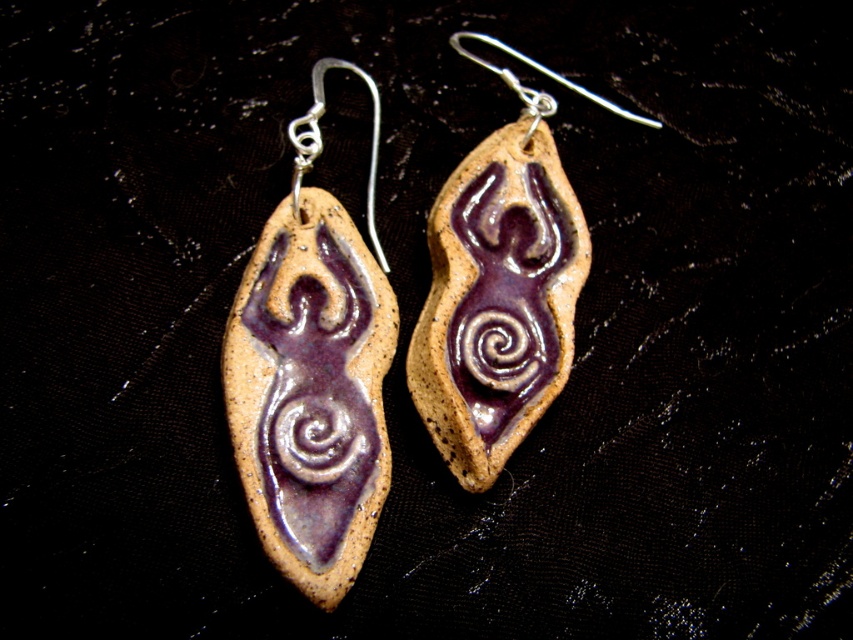
Where is `purple clay earring at center`? purple clay earring at center is located at coordinates 500,285.

Does matte purple clay earring at left appear under purple clay earring at center?

Correct, matte purple clay earring at left is located below purple clay earring at center.

Is matte purple clay earring at left smaller than purple clay earring at center?

Incorrect, matte purple clay earring at left is not smaller in size than purple clay earring at center.

What do you see at coordinates (312, 372) in the screenshot?
I see `matte purple clay earring at left` at bounding box center [312, 372].

You are a GUI agent. You are given a task and a screenshot of the screen. Output one action in this format:
    pyautogui.click(x=<x>, y=<y>)
    Task: Click on the matte purple clay earring at left
    The height and width of the screenshot is (640, 853).
    Given the screenshot: What is the action you would take?
    pyautogui.click(x=312, y=372)

Can you confirm if matte purple clay earring at left is taller than polished silver hook at upper center?

Indeed, matte purple clay earring at left has a greater height compared to polished silver hook at upper center.

Between point (375, 480) and point (531, 61), which one is positioned behind?

The point (531, 61) is behind.

Who is more forward, (x=283, y=573) or (x=519, y=58)?

Point (x=283, y=573)

Image resolution: width=853 pixels, height=640 pixels. Find the location of `matte purple clay earring at left`. matte purple clay earring at left is located at coordinates (312, 372).